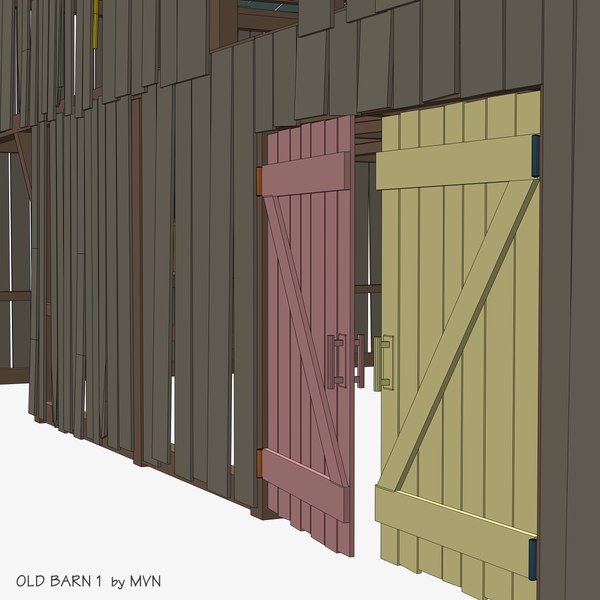
I want to click on top of wall, so click(272, 69).